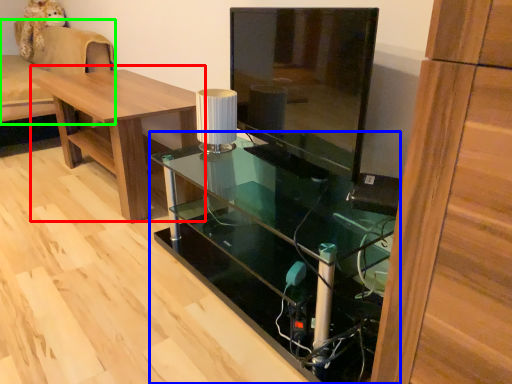
Question: Considering the real-world distances, which object is closest to table (highlighted by a red box)? desk (highlighted by a blue box) or couch (highlighted by a green box).

Choices:
 (A) desk
 (B) couch

Answer: (A)